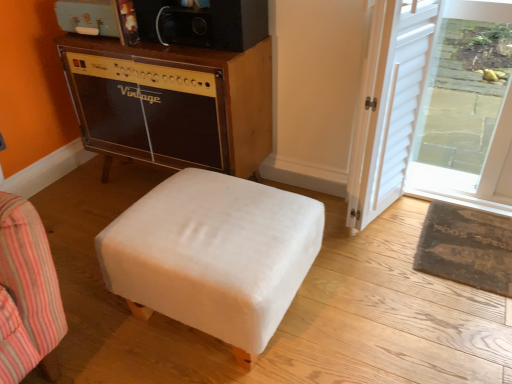
Image resolution: width=512 pixels, height=384 pixels. I want to click on vacant space in front of rustic brown mat at lower right, so click(x=461, y=318).